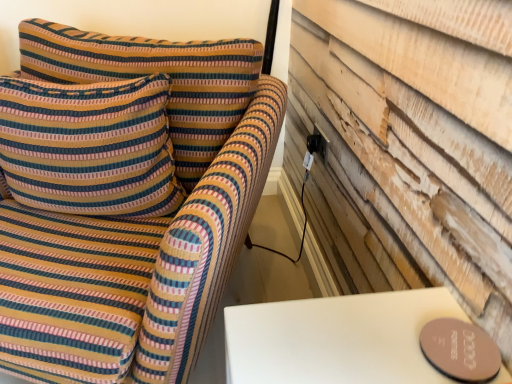
Question: Is striped fabric sofa at left wider or thinner than striped fabric pillow at left?

Choices:
 (A) thin
 (B) wide

Answer: (B)

Question: Do you think striped fabric sofa at left is within striped fabric pillow at left, or outside of it?

Choices:
 (A) outside
 (B) inside

Answer: (A)

Question: In the image, is striped fabric sofa at left positioned in front of or behind striped fabric pillow at left?

Choices:
 (A) behind
 (B) front

Answer: (B)

Question: From the image's perspective, is striped fabric pillow at left located above or below striped fabric sofa at left?

Choices:
 (A) below
 (B) above

Answer: (B)

Question: Is striped fabric pillow at left in front of or behind striped fabric sofa at left in the image?

Choices:
 (A) behind
 (B) front

Answer: (A)

Question: Is striped fabric pillow at left bigger or smaller than striped fabric sofa at left?

Choices:
 (A) big
 (B) small

Answer: (B)

Question: From their relative heights in the image, would you say striped fabric pillow at left is taller or shorter than striped fabric sofa at left?

Choices:
 (A) short
 (B) tall

Answer: (A)